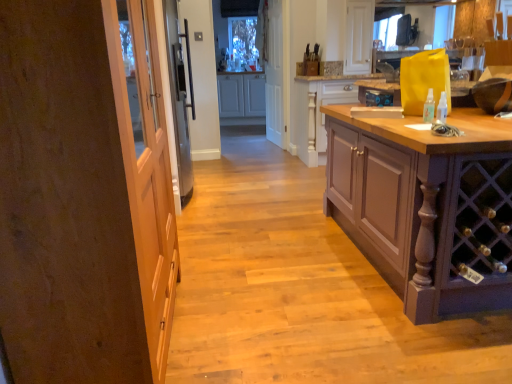
Question: Which direction should I rotate to face white matte cabinet at center, the third cabinetry positioned from the front, — up or down?

Choices:
 (A) up
 (B) down

Answer: (A)

Question: Is clear plastic spray bottle at right at the right side of wooden door at left?

Choices:
 (A) no
 (B) yes

Answer: (B)

Question: Is clear plastic spray bottle at right aimed at wooden door at left?

Choices:
 (A) yes
 (B) no

Answer: (B)

Question: Does clear plastic spray bottle at right appear on the left side of wooden door at left?

Choices:
 (A) no
 (B) yes

Answer: (A)

Question: Considering the relative sizes of clear plastic spray bottle at right and wooden door at left in the image provided, is clear plastic spray bottle at right thinner than wooden door at left?

Choices:
 (A) yes
 (B) no

Answer: (A)

Question: Would you say clear plastic spray bottle at right is a long distance from wooden door at left?

Choices:
 (A) no
 (B) yes

Answer: (B)

Question: From a real-world perspective, does clear plastic spray bottle at right stand above wooden door at left?

Choices:
 (A) yes
 (B) no

Answer: (A)

Question: Is pale wood cabinet at center, the 2th cabinetry viewed from the front, not near clear plastic spray bottle at right?

Choices:
 (A) yes
 (B) no

Answer: (A)

Question: Is clear plastic spray bottle at right a part of pale wood cabinet at center, which is counted as the second cabinetry, starting from the back?

Choices:
 (A) yes
 (B) no

Answer: (B)

Question: Is pale wood cabinet at center, the 2th cabinetry viewed from the front, placed right next to clear plastic spray bottle at right?

Choices:
 (A) no
 (B) yes

Answer: (A)

Question: From a real-world perspective, is pale wood cabinet at center, the 2th cabinetry viewed from the front, positioned over clear plastic spray bottle at right based on gravity?

Choices:
 (A) yes
 (B) no

Answer: (B)

Question: Is pale wood cabinet at center, which is counted as the second cabinetry, starting from the back, oriented away from clear plastic spray bottle at right?

Choices:
 (A) yes
 (B) no

Answer: (B)

Question: Can you confirm if pale wood cabinet at center, the 2th cabinetry viewed from the front, is thinner than clear plastic spray bottle at right?

Choices:
 (A) yes
 (B) no

Answer: (B)

Question: Does clear plastic spray bottle at right lie behind white matte cabinet at center, the first cabinetry when ordered from back to front?

Choices:
 (A) yes
 (B) no

Answer: (B)